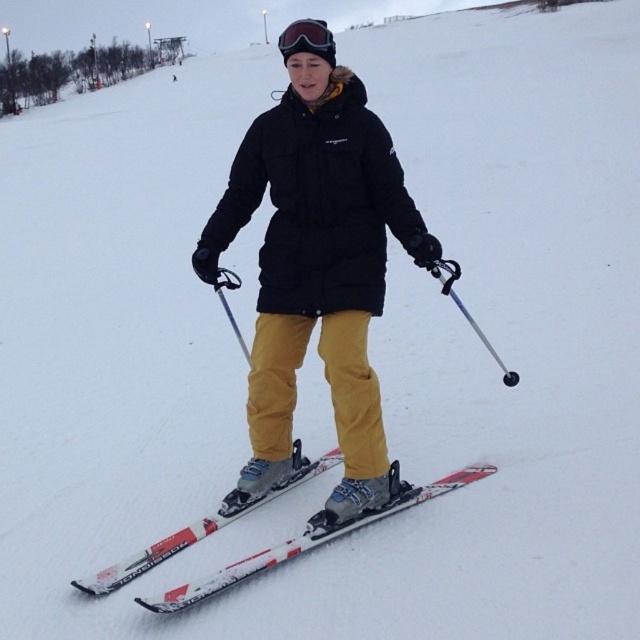
Does glossy ski goggles at center have a greater height compared to metallic silver ski pole at center?

Correct, glossy ski goggles at center is much taller as metallic silver ski pole at center.

Is point (332, 36) positioned in front of point (442, 273)?

That is True.

Which is in front, point (292, 51) or point (452, 298)?

Point (292, 51) is more forward.

I want to click on glossy ski goggles at center, so [x=307, y=38].

Can you confirm if matte black jacket at center is positioned to the left of white matte skis at center?

Yes, matte black jacket at center is to the left of white matte skis at center.

Does point (355, 262) lie behind point (307, 541)?

Yes, point (355, 262) is behind point (307, 541).

Identify the location of matte black jacket at center. The width and height of the screenshot is (640, 640). (316, 273).

Who is shorter, matte black jacket at center or metallic silver ski pole at center?

Standing shorter between the two is metallic silver ski pole at center.

Measure the distance from matte black jacket at center to metallic silver ski pole at center.

They are 90.59 centimeters apart.

Is point (256, 461) more distant than point (435, 269)?

Yes, point (256, 461) is farther from viewer.

Identify the location of matte black jacket at center. The image size is (640, 640). (316, 273).